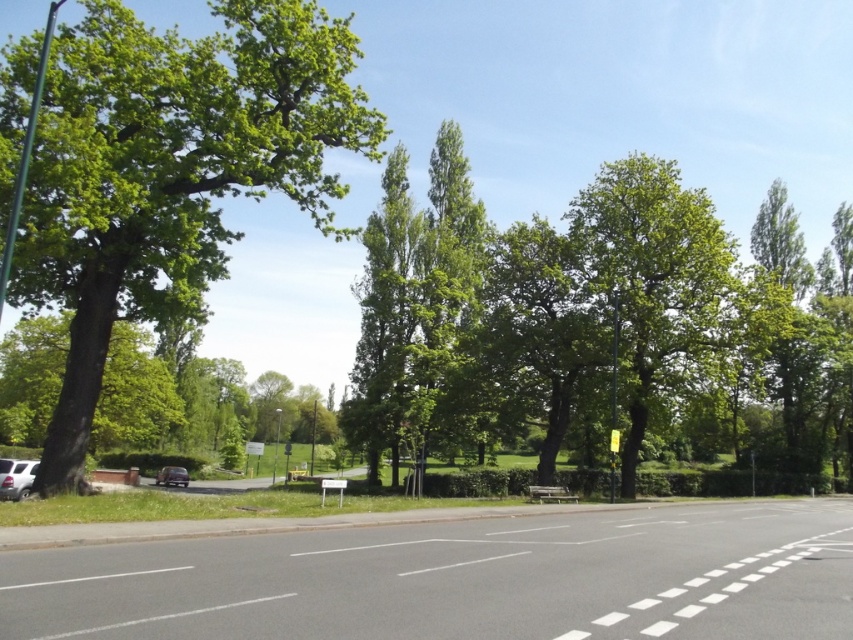
In the scene shown: Who is positioned more to the right, green leafy tree at center or shiny black car at center?

From the viewer's perspective, green leafy tree at center appears more on the right side.

Is green leafy tree at center behind shiny black car at center?

That is False.

Identify the location of green leafy tree at center. The image size is (853, 640). (596, 326).

Locate an element on the screen. Image resolution: width=853 pixels, height=640 pixels. green leafy tree at center is located at coordinates (596, 326).

Who is lower down, green leafy tree at left or shiny black car at center?

Positioned lower is shiny black car at center.

Is green leafy tree at left bigger than shiny black car at center?

Correct, green leafy tree at left is larger in size than shiny black car at center.

What do you see at coordinates (170, 170) in the screenshot? The width and height of the screenshot is (853, 640). I see `green leafy tree at left` at bounding box center [170, 170].

Find the location of `green leafy tree at left`. green leafy tree at left is located at coordinates (170, 170).

How far apart are green leafy tree at center and white matte car at lower left?

They are 125.19 feet apart.

Does point (848, 417) lie in front of point (28, 461)?

No, it is behind (28, 461).

The width and height of the screenshot is (853, 640). Identify the location of green leafy tree at center. (596, 326).